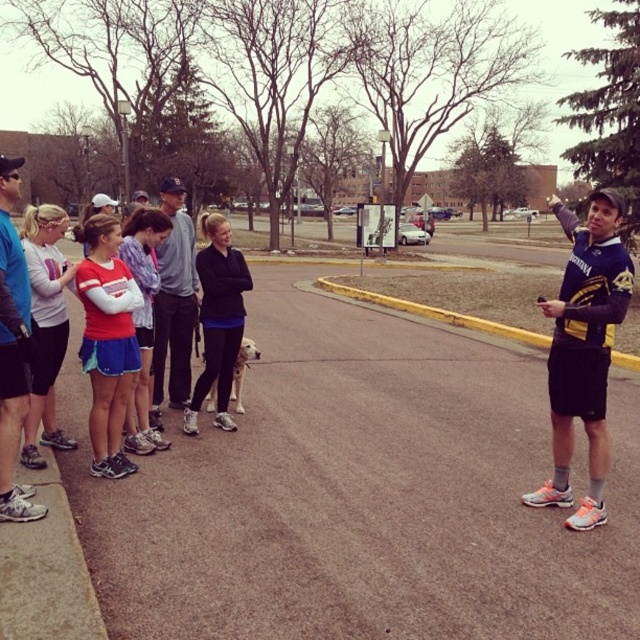
Does point (17, 284) lie behind point (189, 227)?

No, (17, 284) is closer to viewer.

Is point (6, 410) in front of point (163, 310)?

That is True.

I want to click on blue fabric shirt at left, so click(x=12, y=349).

Locate an element on the screen. The height and width of the screenshot is (640, 640). blue fabric shirt at left is located at coordinates (12, 349).